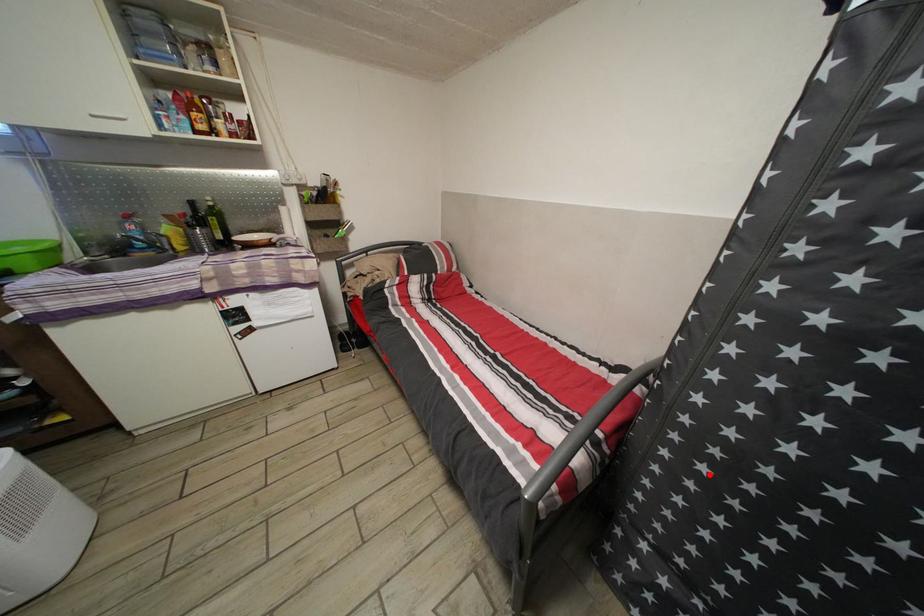
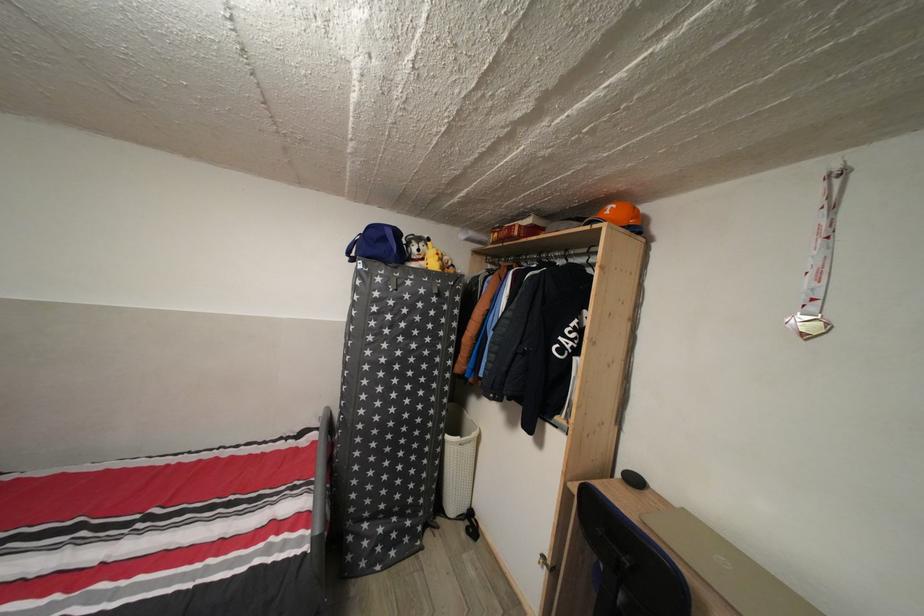
Question: A red point is marked in image1. In image2, is the corresponding 3D point closer to the camera or farther? Reply with the corresponding letter.

Choices:
 (A) The corresponding 3D point is closer.
 (B) The corresponding 3D point is farther.

Answer: (B)